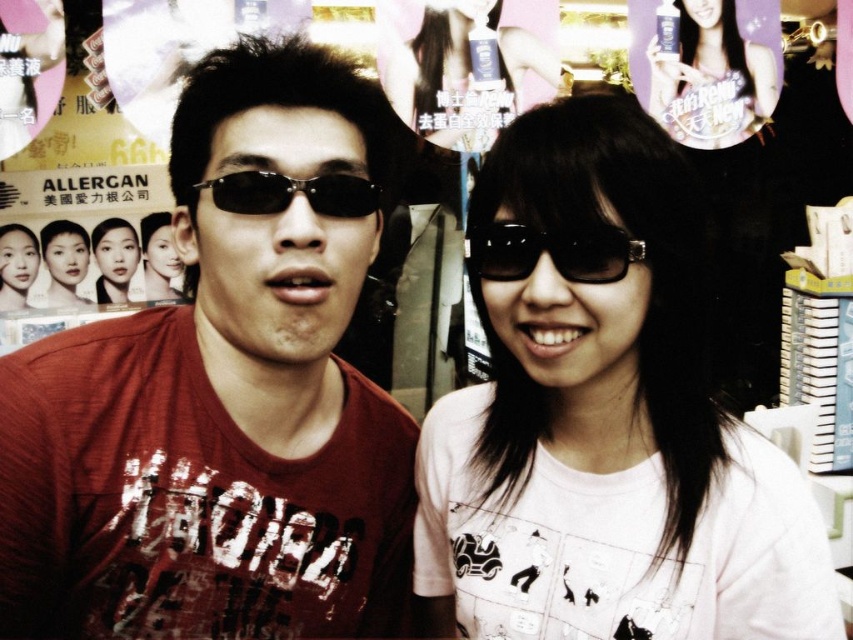
Question: Does matte red t-shirt at left have a larger size compared to matte white bottle at upper right?

Choices:
 (A) yes
 (B) no

Answer: (A)

Question: Which of these objects is positioned farthest from the matte skin at center?

Choices:
 (A) matte white bottle at upper right
 (B) black shiny sunglasses at center
 (C) white matte shirt at center
 (D) smooth skin portrait at left

Answer: (C)

Question: Can you confirm if matte white bottle at upper right is bigger than matte skin at center?

Choices:
 (A) yes
 (B) no

Answer: (A)

Question: Does black plastic sunglasses at left have a lesser width compared to smooth skin portrait at left?

Choices:
 (A) yes
 (B) no

Answer: (B)

Question: Which of the following is the farthest from the observer?

Choices:
 (A) matte black hair at upper center
 (B) matte white bottle at upper right

Answer: (B)

Question: Which point appears closest to the camera in this image?

Choices:
 (A) (30, 241)
 (B) (218, 198)
 (C) (216, 620)
 (D) (567, 257)

Answer: (D)